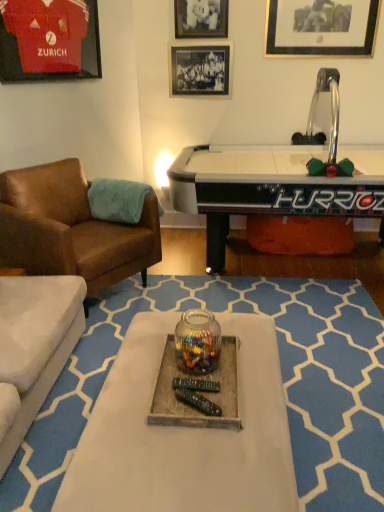
Identify the location of free spot in front of translucent glass jar at center. (194, 398).